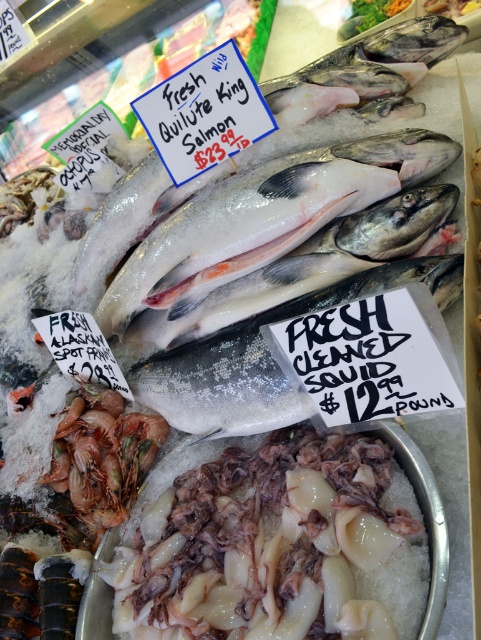
Question: Which of the following is the closest to the observer?

Choices:
 (A) white glossy salmon at center
 (B) shiny silver salmon at center
 (C) translucent white squid at center

Answer: (C)

Question: Which is nearer to the translucent white squid at center?

Choices:
 (A) white glossy salmon at center
 (B) shiny silver salmon at center

Answer: (A)

Question: From the image, what is the correct spatial relationship of translucent white squid at center in relation to shiny silver salmon at center?

Choices:
 (A) left
 (B) right

Answer: (A)

Question: Which point is closer to the camera?

Choices:
 (A) (236, 420)
 (B) (164, 573)

Answer: (B)

Question: Is translucent white squid at center positioned before white glossy salmon at center?

Choices:
 (A) no
 (B) yes

Answer: (B)

Question: Does translucent white squid at center have a lesser width compared to shiny silver salmon at center?

Choices:
 (A) yes
 (B) no

Answer: (A)